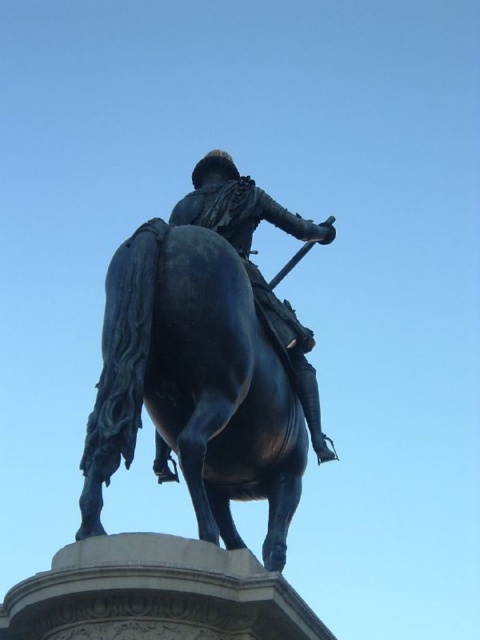
You are standing in front of the bronze equestrian statue. You want to know how far the point at coordinates point (275,394) is from your current position. Can you determine the distance?

The distance of point (275,394) from camera is 261.23 feet.

Consider the image. You are standing in front of the bronze equestrian statue. The statue includes a shiny black horse at center. If you were to place a small flower at the point marked by coordinates point (194, 385), where would it be placed relative to the shiny black horse at center?

The point (194, 385) corresponds to the shiny black horse at center, so placing a flower there would put it directly on the shiny black horse at center.

You are standing at the center of the image. Where is the shiny black horse at center located in terms of coordinates?

The shiny black horse at center is located at coordinates point [194,385].